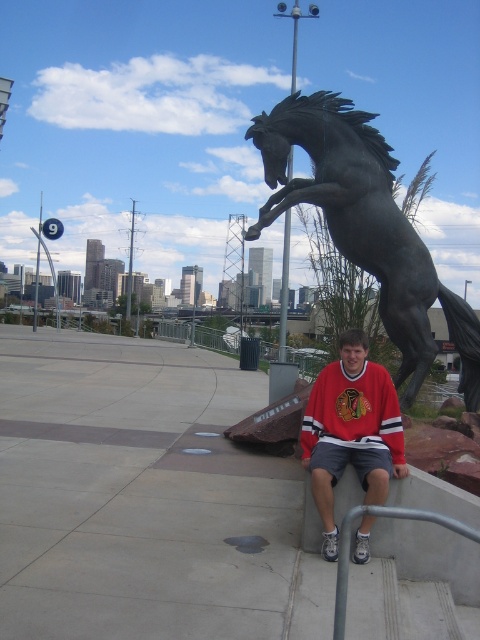
You are a photographer aiming to capture the red matte jersey at center and the gray metallic rail at lower center in the same frame. Which object will appear taller in the photo?

The red matte jersey at center will appear taller in the photo since it has a greater height compared to the gray metallic rail at lower center according to the description.

You are a photographer trying to capture both the bronze horse at upper right and the gray metallic rail at lower center in the same frame. Given their sizes, which object will appear bigger in your photo?

The bronze horse at upper right will appear bigger in the photo since it is larger in size than the gray metallic rail at lower center.

You are standing in the urban scene and want to place a small flag at the point closer to you. Which point should you choose between point (x=443, y=305) and point (x=356, y=410)?

Point (x=443, y=305) is further to the camera than point (x=356, y=410), so you should choose point (x=356, y=410) as it is closer to you.